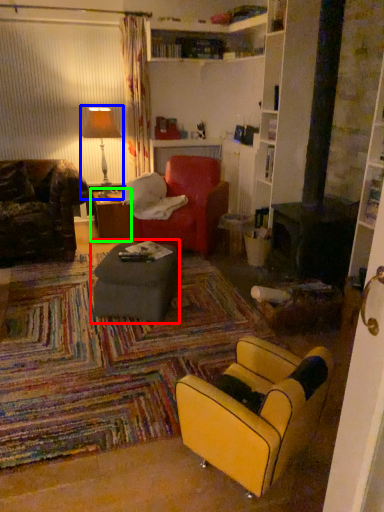
Question: Which object is positioned farthest from table (highlighted by a red box)? Select from table lamp (highlighted by a blue box) and table (highlighted by a green box).

Choices:
 (A) table lamp
 (B) table

Answer: (A)